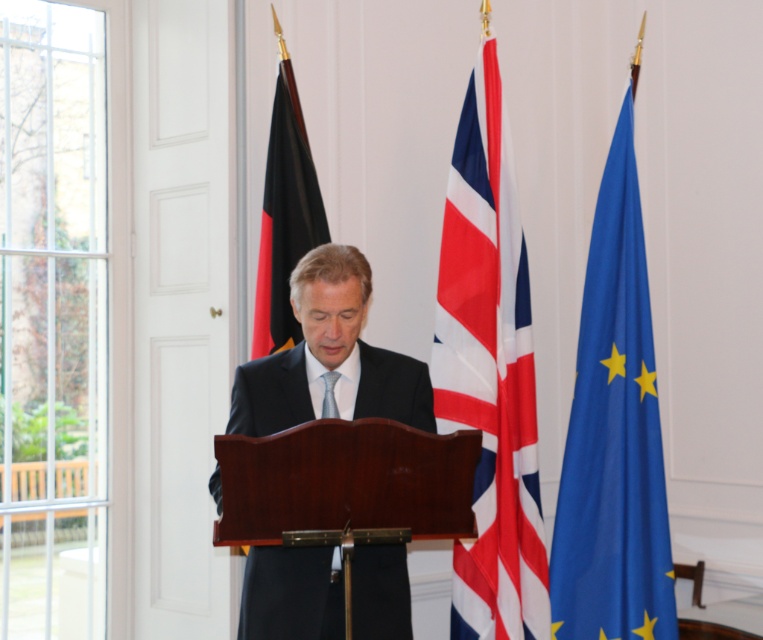
You are a photographer at the event and need to capture a photo where both the matte black suit at center and the black fabric flag at left are visible. Considering their sizes, which one should you ensure is closer to the camera to avoid cropping?

Since the matte black suit at center is wider than the black fabric flag at left, you should position the camera closer to the matte black suit at center to ensure both fit without cropping.